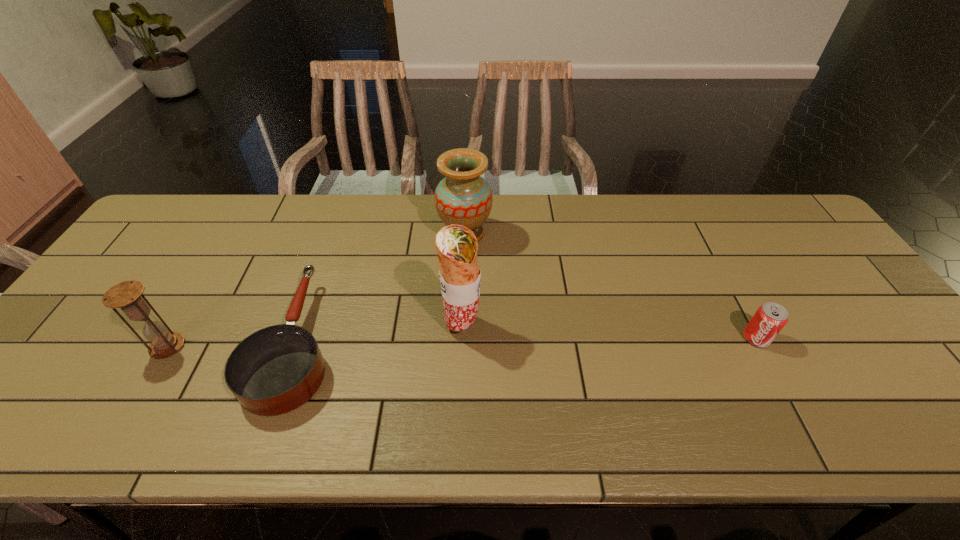
In the image, there is a desktop. At what (x,y) coordinates should I click in order to perform the action: click on free space at the left edge. Please return your answer as a coordinate pair (x, y). Looking at the image, I should click on (64, 337).

You are a GUI agent. You are given a task and a screenshot of the screen. Output one action in this format:
    pyautogui.click(x=<x>, y=<y>)
    Task: Click on the free space at the right edge of the desktop
    The height and width of the screenshot is (540, 960).
    Given the screenshot: What is the action you would take?
    pyautogui.click(x=823, y=281)

The width and height of the screenshot is (960, 540). What are the coordinates of `free spot at the far right corner of the desktop` in the screenshot? It's located at (774, 212).

Where is `blank region between the burrito and the rightmost object`? blank region between the burrito and the rightmost object is located at coordinates (609, 332).

Find the location of `free space between the shortest object and the burrito`. free space between the shortest object and the burrito is located at coordinates (379, 334).

At what (x,y) coordinates should I click in order to perform the action: click on free space that is in between the pan and the burrito. Please return your answer as a coordinate pair (x, y). The image size is (960, 540). Looking at the image, I should click on (379, 334).

At what (x,y) coordinates should I click in order to perform the action: click on vacant space that's between the farthest object and the rightmost object. Please return your answer as a coordinate pair (x, y). This screenshot has width=960, height=540. Looking at the image, I should click on (611, 286).

You are a GUI agent. You are given a task and a screenshot of the screen. Output one action in this format:
    pyautogui.click(x=<x>, y=<y>)
    Task: Click on the vacant point located between the burrito and the second shortest object
    The image size is (960, 540).
    Given the screenshot: What is the action you would take?
    pyautogui.click(x=609, y=332)

Identify the location of free spot between the third tallest object and the soda can. This screenshot has width=960, height=540. (462, 342).

Where is `vacant space in between the third tallest object and the shortest object`? vacant space in between the third tallest object and the shortest object is located at coordinates (232, 345).